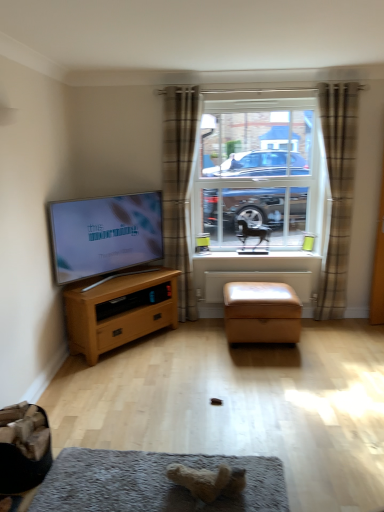
Image resolution: width=384 pixels, height=512 pixels. I want to click on vacant space to the left of satin tan ottoman at center, so click(200, 344).